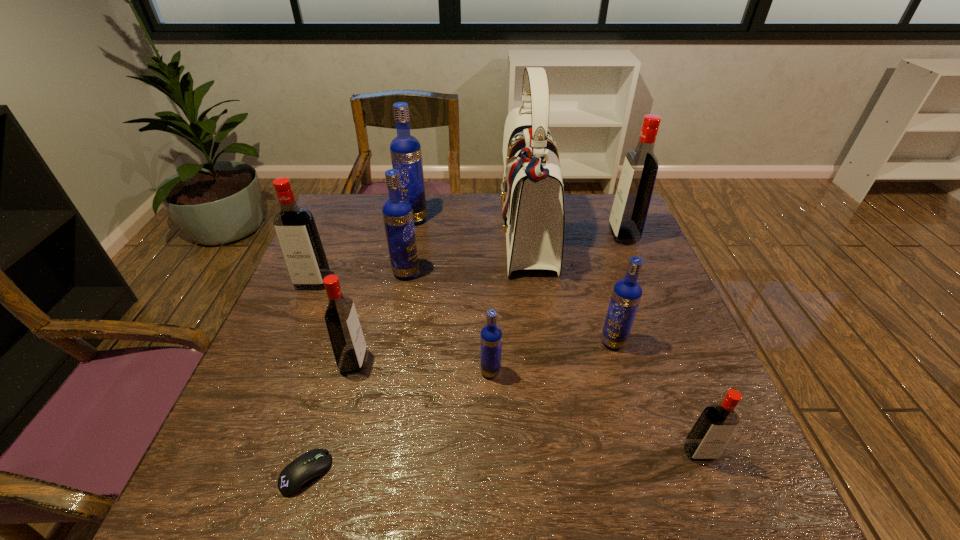
Where is `vacant region that satisfies the following two spatial constraints: 1. on the front and back of the farthest red vodka; 2. on the front side of the shortest object`? vacant region that satisfies the following two spatial constraints: 1. on the front and back of the farthest red vodka; 2. on the front side of the shortest object is located at coordinates (723, 472).

Where is `free space that satisfies the following two spatial constraints: 1. on the back side of the black computer equipment; 2. on the left side of the biggest blue vodka`? free space that satisfies the following two spatial constraints: 1. on the back side of the black computer equipment; 2. on the left side of the biggest blue vodka is located at coordinates (382, 219).

You are a GUI agent. You are given a task and a screenshot of the screen. Output one action in this format:
    pyautogui.click(x=<x>, y=<y>)
    Task: Click on the blank area in the image that satisfies the following two spatial constraints: 1. on the front side of the biggest blue vodka; 2. on the front and back of the second red vodka from left to right
    Image resolution: width=960 pixels, height=540 pixels.
    Given the screenshot: What is the action you would take?
    pyautogui.click(x=385, y=362)

Identify the location of vacant position in the image that satisfies the following two spatial constraints: 1. on the front and back of the shortest object; 2. on the left side of the leftmost vodka. The height and width of the screenshot is (540, 960). (231, 472).